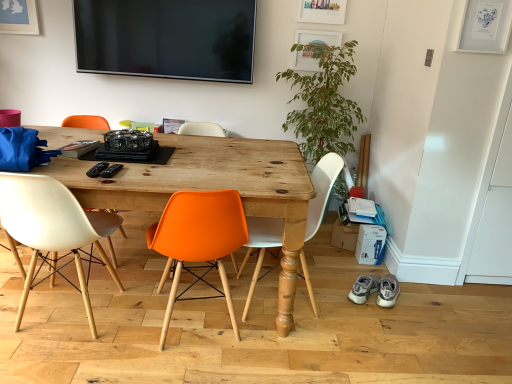
Describe the element at coordinates (364, 288) in the screenshot. This screenshot has width=512, height=384. I see `gray suede sneakers at lower right, positioned as the first footwear in left-to-right order` at that location.

The image size is (512, 384). What do you see at coordinates (324, 102) in the screenshot? I see `green leafy plant at right` at bounding box center [324, 102].

What is the approximate height of gray suede sneakers at lower right, acting as the second footwear starting from the left?

The height of gray suede sneakers at lower right, acting as the second footwear starting from the left, is 14.19 centimeters.

Locate an element on the screen. Image resolution: width=512 pixels, height=384 pixels. matte white chair at left, placed as the first chair when sorted from left to right is located at coordinates (54, 230).

Considering the sizes of objects gray suede sneakers at lower right, the second footwear viewed from the right, and green leafy plant at right in the image provided, who is wider, gray suede sneakers at lower right, the second footwear viewed from the right, or green leafy plant at right?

With larger width is green leafy plant at right.

Considering the sizes of gray suede sneakers at lower right, the second footwear viewed from the right, and green leafy plant at right in the image, is gray suede sneakers at lower right, the second footwear viewed from the right, bigger or smaller than green leafy plant at right?

gray suede sneakers at lower right, the second footwear viewed from the right, is smaller than green leafy plant at right.

From the image's perspective, is gray suede sneakers at lower right, the second footwear viewed from the right, positioned above or below green leafy plant at right?

Based on their image positions, gray suede sneakers at lower right, the second footwear viewed from the right, is located beneath green leafy plant at right.

Is point (301, 91) positioned behind point (214, 242)?

Yes, point (301, 91) is farther from viewer.

From the image's perspective, is green leafy plant at right on orange plastic chair at center, which appears as the 2th chair when viewed from the left?

Indeed, from the image's perspective, green leafy plant at right is shown above orange plastic chair at center, which appears as the 2th chair when viewed from the left.

Consider the image. Does green leafy plant at right turn towards orange plastic chair at center, which appears as the second chair when viewed from the right?

No, green leafy plant at right is not aimed at orange plastic chair at center, which appears as the second chair when viewed from the right.

Is orange plastic chair at center, which appears as the 2th chair when viewed from the left, wider than matte white chair at left, arranged as the 3th chair when viewed from the right?

Yes.

Which object is positioned more to the right, orange plastic chair at center, which appears as the second chair when viewed from the right, or matte white chair at left, placed as the first chair when sorted from left to right?

Positioned to the right is orange plastic chair at center, which appears as the second chair when viewed from the right.

Is orange plastic chair at center, which appears as the 2th chair when viewed from the left, oriented towards matte white chair at left, placed as the first chair when sorted from left to right?

No, orange plastic chair at center, which appears as the 2th chair when viewed from the left, is not turned towards matte white chair at left, placed as the first chair when sorted from left to right.

Is orange plastic chair at center, which appears as the second chair when viewed from the right, further to the viewer compared to matte white chair at left, placed as the first chair when sorted from left to right?

No, orange plastic chair at center, which appears as the second chair when viewed from the right, is closer to the camera.

Are gray suede sneakers at lower right, positioned as the first footwear in left-to-right order, and matte white chair at left, arranged as the 3th chair when viewed from the right, far apart?

Yes, gray suede sneakers at lower right, positioned as the first footwear in left-to-right order, and matte white chair at left, arranged as the 3th chair when viewed from the right, are located far from each other.

Which is behind, point (367, 277) or point (76, 239)?

The point (367, 277) is farther from the camera.

How many degrees apart are the facing directions of gray suede sneakers at lower right, the second footwear viewed from the right, and matte white chair at left, arranged as the 3th chair when viewed from the right?

The angle between the facing direction of gray suede sneakers at lower right, the second footwear viewed from the right, and the facing direction of matte white chair at left, arranged as the 3th chair when viewed from the right, is 158 degrees.

Considering the relative positions of gray suede sneakers at lower right, positioned as the first footwear in left-to-right order, and matte white chair at left, placed as the first chair when sorted from left to right, in the image provided, is gray suede sneakers at lower right, positioned as the first footwear in left-to-right order, to the left or to the right of matte white chair at left, placed as the first chair when sorted from left to right,?

gray suede sneakers at lower right, positioned as the first footwear in left-to-right order, is to the right of matte white chair at left, placed as the first chair when sorted from left to right.

Does green leafy plant at right have a greater width compared to gray suede sneakers at lower right, positioned as the first footwear in left-to-right order?

Correct, the width of green leafy plant at right exceeds that of gray suede sneakers at lower right, positioned as the first footwear in left-to-right order.

From a real-world perspective, which is physically above, green leafy plant at right or gray suede sneakers at lower right, the second footwear viewed from the right?

green leafy plant at right is physically above.

Is green leafy plant at right oriented towards gray suede sneakers at lower right, the second footwear viewed from the right?

Yes.

From the image's perspective, which is above, green leafy plant at right or gray suede sneakers at lower right, the second footwear viewed from the right?

From the image's view, green leafy plant at right is above.

How different are the orientations of orange plastic chair at center, which appears as the second chair when viewed from the right, and wooden table at center in degrees?

The facing directions of orange plastic chair at center, which appears as the second chair when viewed from the right, and wooden table at center are 165 degrees apart.

Is orange plastic chair at center, which appears as the second chair when viewed from the right, positioned far away from wooden table at center?

No, orange plastic chair at center, which appears as the second chair when viewed from the right, is not far from wooden table at center.

From the image's perspective, which is above, orange plastic chair at center, which appears as the second chair when viewed from the right, or wooden table at center?

wooden table at center is shown above in the image.

In the scene shown: Which object is positioned more to the right, orange plastic chair at center, which appears as the 2th chair when viewed from the left, or wooden table at center?

orange plastic chair at center, which appears as the 2th chair when viewed from the left, is more to the right.

Does gray suede sneakers at lower right, the second footwear viewed from the right, have a larger size compared to gray suede sneakers at lower right, positioned as the first footwear in right-to-left order?

No.

From the picture: From the image's perspective, is gray suede sneakers at lower right, positioned as the first footwear in left-to-right order, located above gray suede sneakers at lower right, positioned as the first footwear in right-to-left order?

Indeed, from the image's perspective, gray suede sneakers at lower right, positioned as the first footwear in left-to-right order, is shown above gray suede sneakers at lower right, positioned as the first footwear in right-to-left order.

Is gray suede sneakers at lower right, positioned as the first footwear in left-to-right order, touching gray suede sneakers at lower right, acting as the second footwear starting from the left?

Indeed, gray suede sneakers at lower right, positioned as the first footwear in left-to-right order, and gray suede sneakers at lower right, acting as the second footwear starting from the left, are beside each other and touching.

What's the angular difference between gray suede sneakers at lower right, positioned as the first footwear in left-to-right order, and gray suede sneakers at lower right, positioned as the first footwear in right-to-left order,'s facing directions?

0.688 degrees.

Find the location of a particular element. The width and height of the screenshot is (512, 384). footwear that is the 1st object to the right of the green leafy plant at right, starting at the anchor is located at coordinates (364, 288).

In order to click on plant positioned vertically above the orange plastic chair at center, which appears as the second chair when viewed from the right (from a real-world perspective) in this screenshot , I will do point(324,102).

Considering their positions, is white matte chair at center, acting as the 1th chair starting from the right, positioned further to wooden table at center than matte white chair at left, arranged as the 3th chair when viewed from the right?

Based on the image, matte white chair at left, arranged as the 3th chair when viewed from the right, appears to be further to wooden table at center.

Based on their spatial positions, is green leafy plant at right or white matte chair at center, the third chair viewed from the left, further from orange plastic chair at center, which appears as the second chair when viewed from the right?

Among the two, green leafy plant at right is located further to orange plastic chair at center, which appears as the second chair when viewed from the right.

Considering their positions, is green leafy plant at right positioned closer to orange plastic chair at center, which appears as the 2th chair when viewed from the left, than matte white chair at left, arranged as the 3th chair when viewed from the right?

Based on the image, matte white chair at left, arranged as the 3th chair when viewed from the right, appears to be nearer to orange plastic chair at center, which appears as the 2th chair when viewed from the left.

Estimate the real-world distances between objects in this image. Which object is closer to wooden table at center, gray suede sneakers at lower right, the second footwear viewed from the right, or green leafy plant at right?

Among the two, green leafy plant at right is located nearer to wooden table at center.

Which object lies nearer to the anchor point matte white chair at left, arranged as the 3th chair when viewed from the right, white matte chair at center, acting as the 1th chair starting from the right, or gray suede sneakers at lower right, acting as the second footwear starting from the left?

white matte chair at center, acting as the 1th chair starting from the right, is positioned closer to the anchor matte white chair at left, arranged as the 3th chair when viewed from the right.

Estimate the real-world distances between objects in this image. Which object is closer to matte white chair at left, placed as the first chair when sorted from left to right, gray suede sneakers at lower right, acting as the second footwear starting from the left, or wooden table at center?

Based on the image, wooden table at center appears to be nearer to matte white chair at left, placed as the first chair when sorted from left to right.

From the image, which object appears to be farther from gray suede sneakers at lower right, positioned as the first footwear in right-to-left order, gray suede sneakers at lower right, the second footwear viewed from the right, or orange plastic chair at center, which appears as the second chair when viewed from the right?

orange plastic chair at center, which appears as the second chair when viewed from the right.

When comparing their distances from gray suede sneakers at lower right, positioned as the first footwear in left-to-right order, does wooden table at center or gray suede sneakers at lower right, acting as the second footwear starting from the left, seem closer?

gray suede sneakers at lower right, acting as the second footwear starting from the left, is positioned closer to the anchor gray suede sneakers at lower right, positioned as the first footwear in left-to-right order.

Where is `plant located between matte white chair at left, placed as the first chair when sorted from left to right, and gray suede sneakers at lower right, acting as the second footwear starting from the left, in the left-right direction`? plant located between matte white chair at left, placed as the first chair when sorted from left to right, and gray suede sneakers at lower right, acting as the second footwear starting from the left, in the left-right direction is located at coordinates (324, 102).

At what (x,y) coordinates should I click in order to perform the action: click on footwear located between wooden table at center and gray suede sneakers at lower right, acting as the second footwear starting from the left, in the left-right direction. Please return your answer as a coordinate pair (x, y). This screenshot has height=384, width=512. Looking at the image, I should click on (364, 288).

The image size is (512, 384). What are the coordinates of `footwear situated between white matte chair at center, the third chair viewed from the left, and gray suede sneakers at lower right, positioned as the first footwear in right-to-left order, from left to right` in the screenshot? It's located at (364, 288).

At what (x,y) coordinates should I click in order to perform the action: click on plant situated between matte white chair at left, placed as the first chair when sorted from left to right, and gray suede sneakers at lower right, positioned as the first footwear in left-to-right order, from left to right. Please return your answer as a coordinate pair (x, y). This screenshot has width=512, height=384. Looking at the image, I should click on (324, 102).